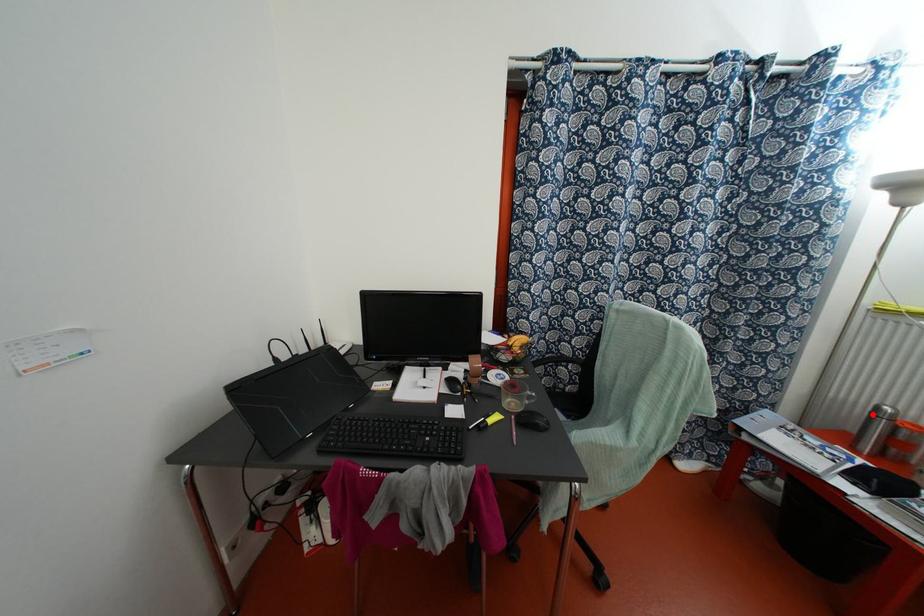
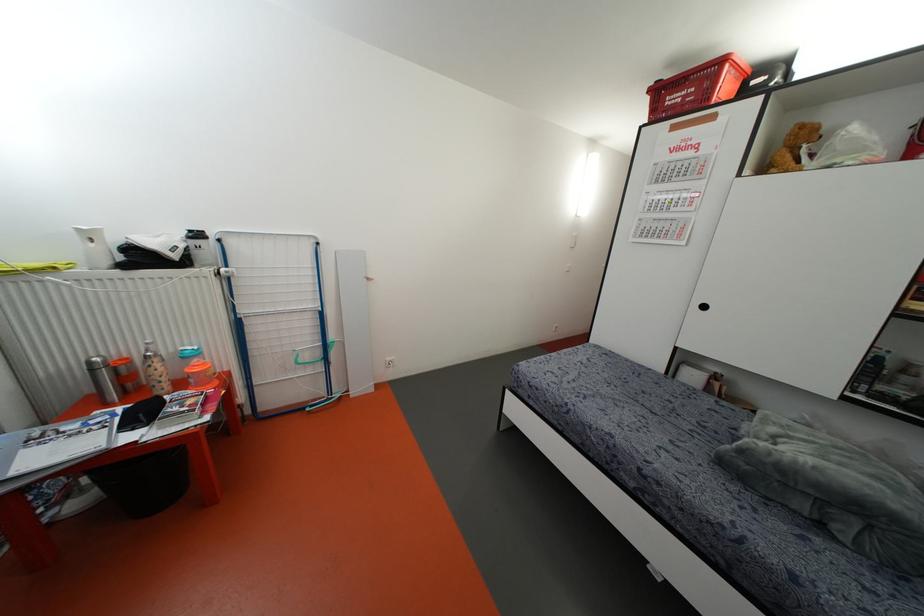
The point at the highlighted location is marked in the first image. Where is the corresponding point in the second image?

(91, 370)